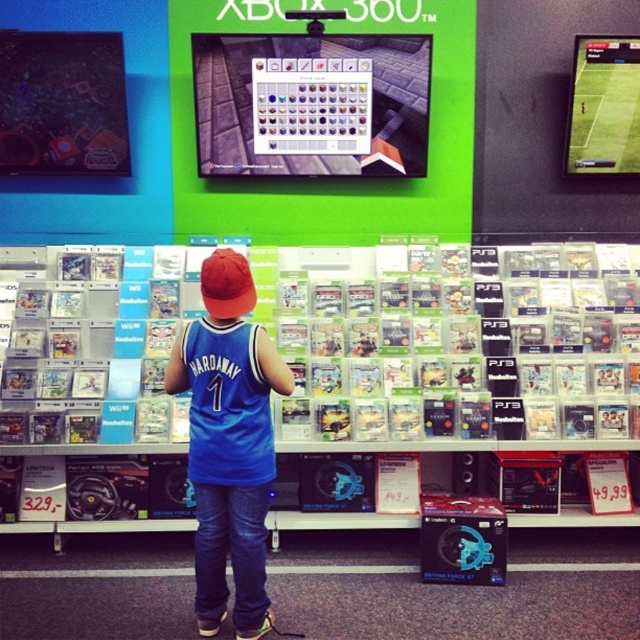
How far apart are blue jersey at center and red fabric baseball cap at center?

They are 16.83 inches apart.

Between blue jersey at center and red fabric baseball cap at center, which one is positioned higher?

red fabric baseball cap at center

Measure the distance between blue jersey at center and camera.

blue jersey at center and camera are 8.99 feet apart from each other.

The image size is (640, 640). In order to click on blue jersey at center in this screenshot , I will do click(228, 442).

In the scene shown: Is blue jersey at center to the right of green matte soccer game at upper center from the viewer's perspective?

Incorrect, blue jersey at center is not on the right side of green matte soccer game at upper center.

Find the location of a particular element. The image size is (640, 640). blue jersey at center is located at coordinates (228, 442).

Is green matte soccer game at upper center behind red fabric baseball cap at center?

Yes, green matte soccer game at upper center is further from the viewer.

Is green matte soccer game at upper center to the left of red fabric baseball cap at center from the viewer's perspective?

Incorrect, green matte soccer game at upper center is not on the left side of red fabric baseball cap at center.

Is point (570, 154) more distant than point (243, 269)?

Yes.

Locate an element on the screen. green matte soccer game at upper center is located at coordinates (604, 106).